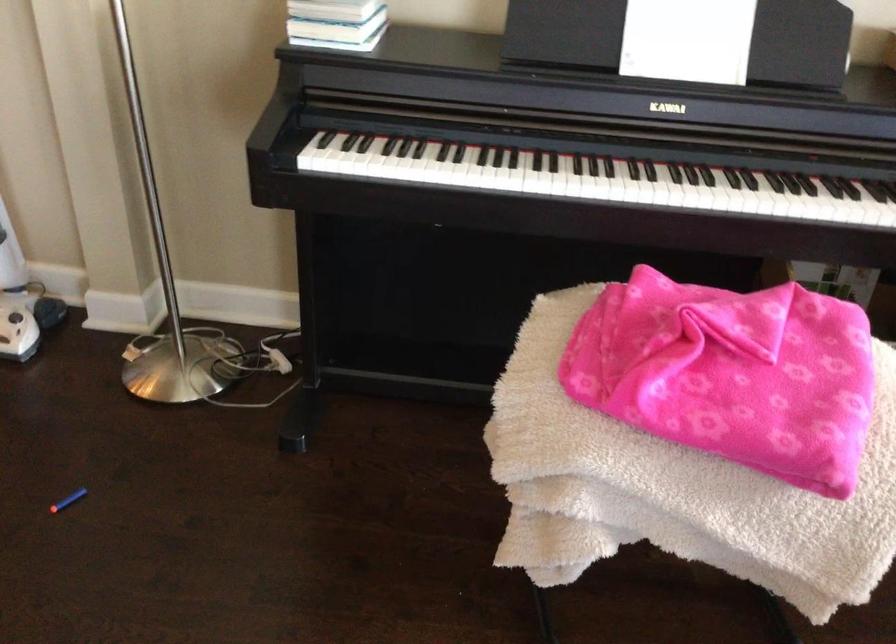
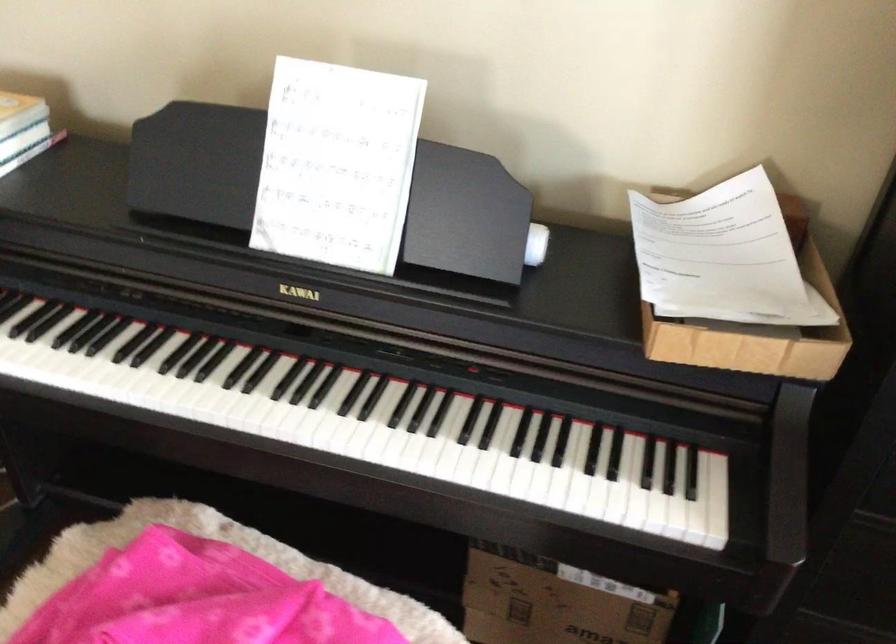
Find the pixel in the second image that matches the point at 500,167 in the first image.

(58, 368)